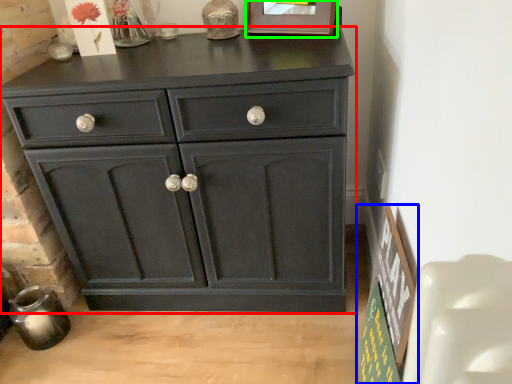
Question: Which is farther away from chest of drawers (highlighted by a red box)? bulletin board (highlighted by a blue box) or picture frame (highlighted by a green box)?

Choices:
 (A) bulletin board
 (B) picture frame

Answer: (B)